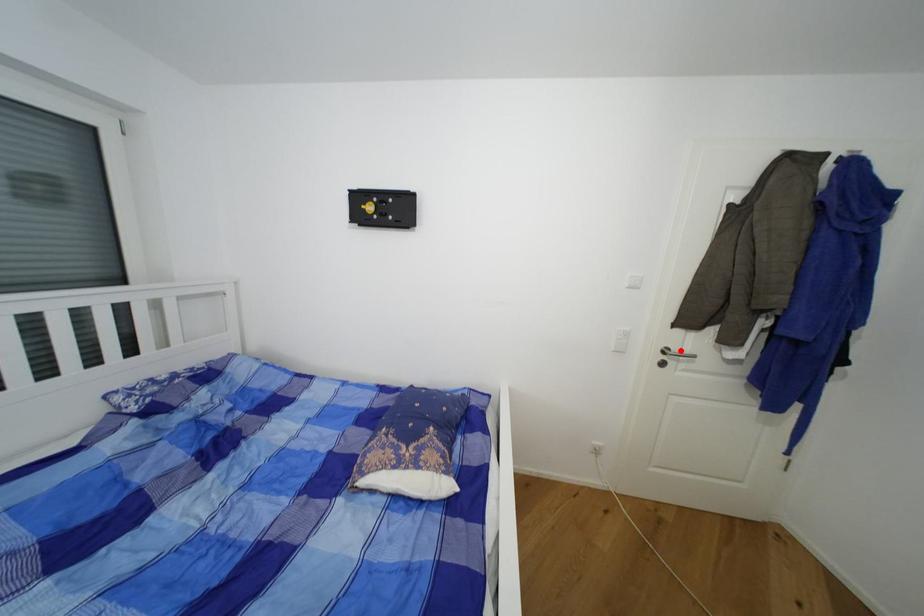
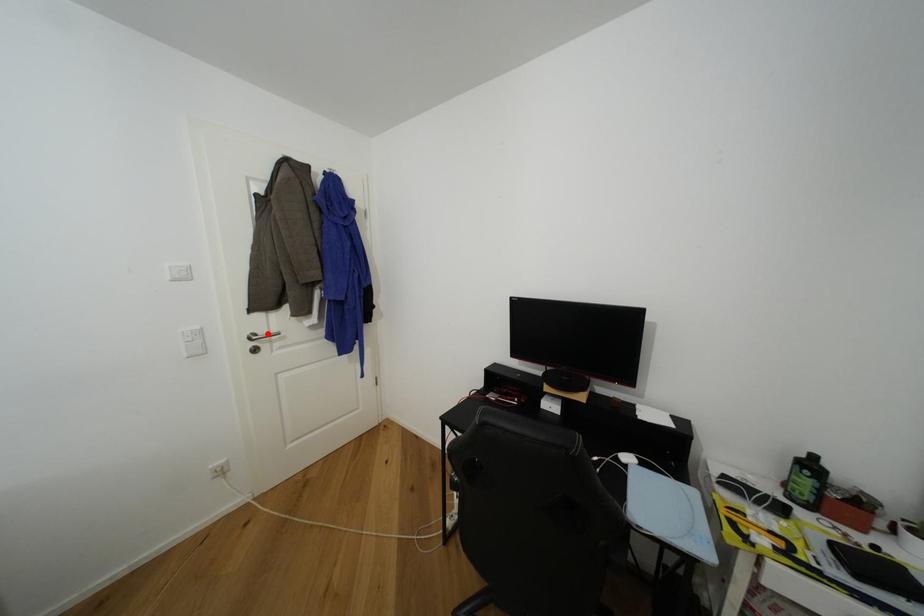
I am providing you with two images of the same scene from different viewpoints. A red point is marked on the first image and another point is marked on the second image. Does the point marked in image1 correspond to the same location as the one in image2?

Yes